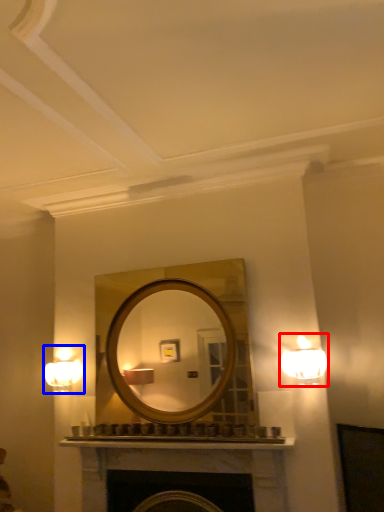
Question: Which point is further to the camera, lamp (highlighted by a red box) or fixture (highlighted by a blue box)?

Choices:
 (A) lamp
 (B) fixture

Answer: (B)